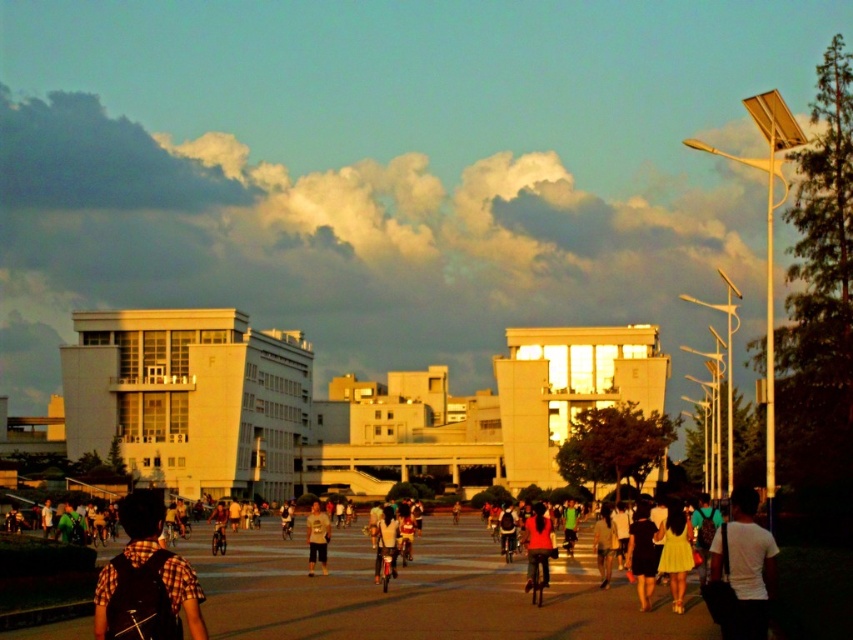
Does plaid shirt backpack at lower left appear under dark blue jeans at center?

Incorrect, plaid shirt backpack at lower left is not positioned below dark blue jeans at center.

Is point (151, 508) positioned after point (614, 552)?

No, it is in front of (614, 552).

Who is more distant from viewer, (x=155, y=497) or (x=612, y=552)?

The point (x=612, y=552) is more distant.

Locate an element on the screen. The width and height of the screenshot is (853, 640). plaid shirt backpack at lower left is located at coordinates (141, 525).

Is plaid shirt backpack at lower left behind green fabric jacket at lower left?

No, plaid shirt backpack at lower left is in front of green fabric jacket at lower left.

Looking at this image, is plaid shirt backpack at lower left bigger than green fabric jacket at lower left?

Yes, plaid shirt backpack at lower left is bigger than green fabric jacket at lower left.

At what (x,y) coordinates should I click in order to perform the action: click on plaid shirt backpack at lower left. Please return your answer as a coordinate pair (x, y). This screenshot has height=640, width=853. Looking at the image, I should click on point(141,525).

Can you confirm if white matte shirt at center-right is thinner than matte black backpack at center?

Incorrect, white matte shirt at center-right's width is not less than matte black backpack at center's.

The height and width of the screenshot is (640, 853). Describe the element at coordinates (746, 566) in the screenshot. I see `white matte shirt at center-right` at that location.

Is point (747, 490) behind point (459, 506)?

No, it is in front of (459, 506).

At what (x,y) coordinates should I click in order to perform the action: click on white matte shirt at center-right. Please return your answer as a coordinate pair (x, y). Looking at the image, I should click on (746, 566).